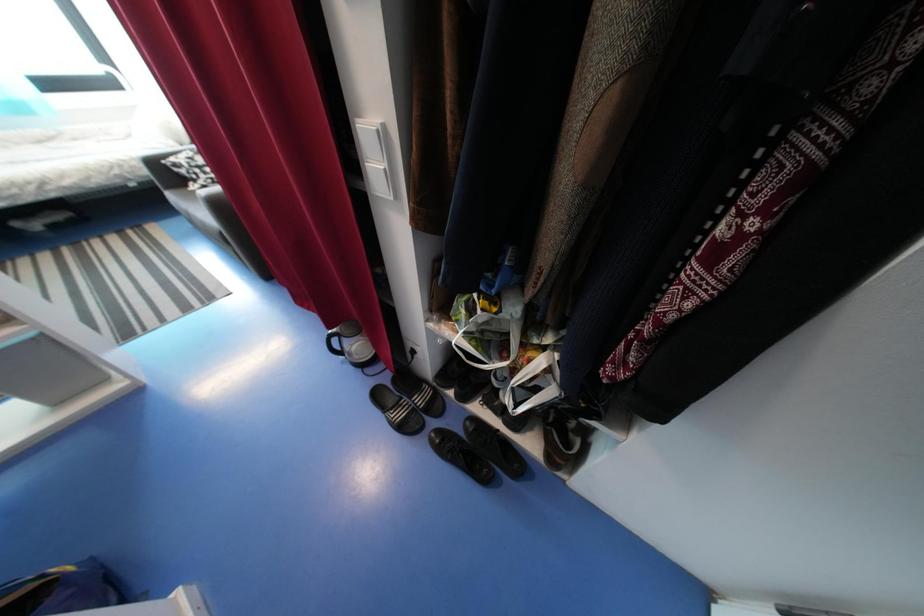
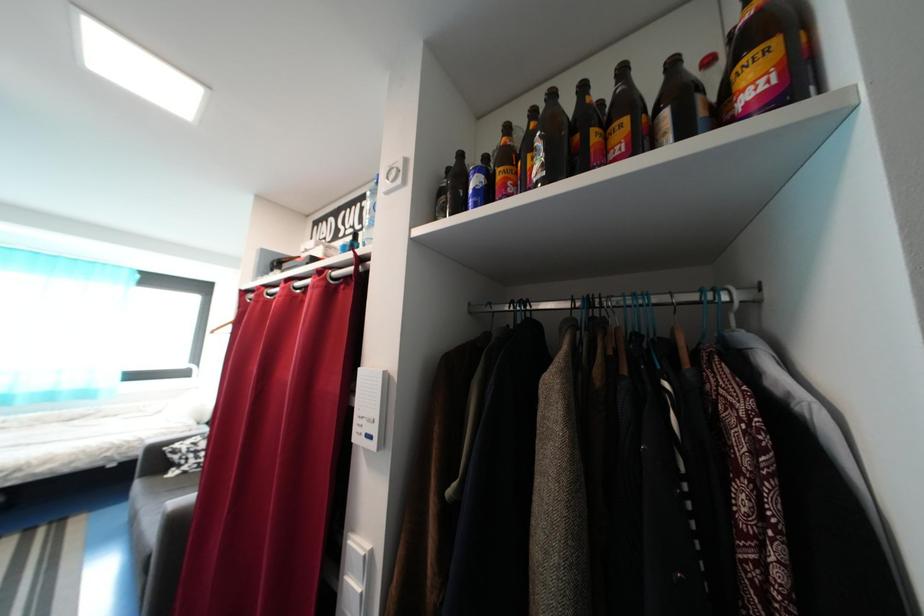
Question: How did the camera likely rotate?

Choices:
 (A) Left
 (B) Right
 (C) Up
 (D) Down

Answer: (C)